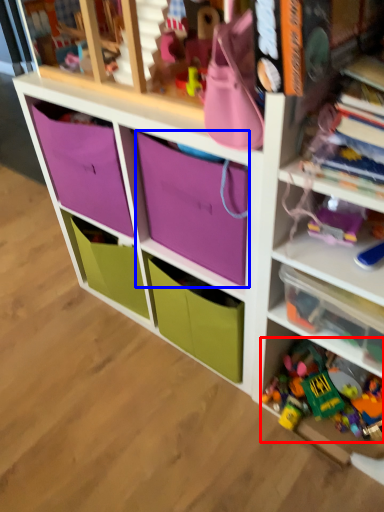
Question: Which point is further to the camera, toy (highlighted by a red box) or storage box (highlighted by a blue box)?

Choices:
 (A) toy
 (B) storage box

Answer: (A)